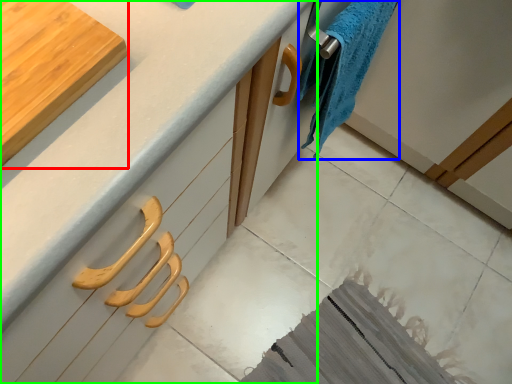
Question: Which object is positioned closest to cutting board (highlighted by a red box)? Select from bath towel (highlighted by a blue box) and countertop (highlighted by a green box).

Choices:
 (A) bath towel
 (B) countertop

Answer: (B)